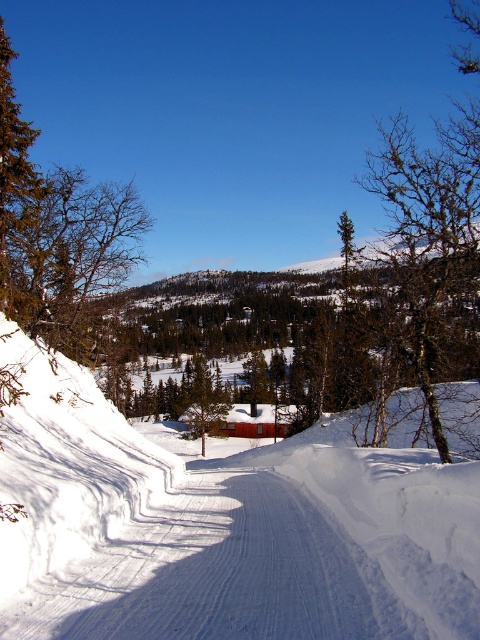
Question: Which of the following is the farthest from the observer?

Choices:
 (A) brown/dry wood tree at left
 (B) brown/dry wood tree at right
 (C) green coniferous tree at left

Answer: (A)

Question: Considering the relative positions of brown/dry wood tree at right and green coniferous tree at left in the image provided, where is brown/dry wood tree at right located with respect to green coniferous tree at left?

Choices:
 (A) left
 (B) right

Answer: (B)

Question: Which object is the farthest from the brown/dry wood tree at left?

Choices:
 (A) green coniferous tree at left
 (B) brown/dry wood tree at right

Answer: (B)

Question: Which of the following is the closest to the observer?

Choices:
 (A) (113, 225)
 (B) (12, 92)

Answer: (B)

Question: Observing the image, what is the correct spatial positioning of brown/dry wood tree at right in reference to brown/dry wood tree at left?

Choices:
 (A) below
 (B) above

Answer: (B)

Question: Is brown/dry wood tree at left to the right of green coniferous tree at left from the viewer's perspective?

Choices:
 (A) yes
 (B) no

Answer: (B)